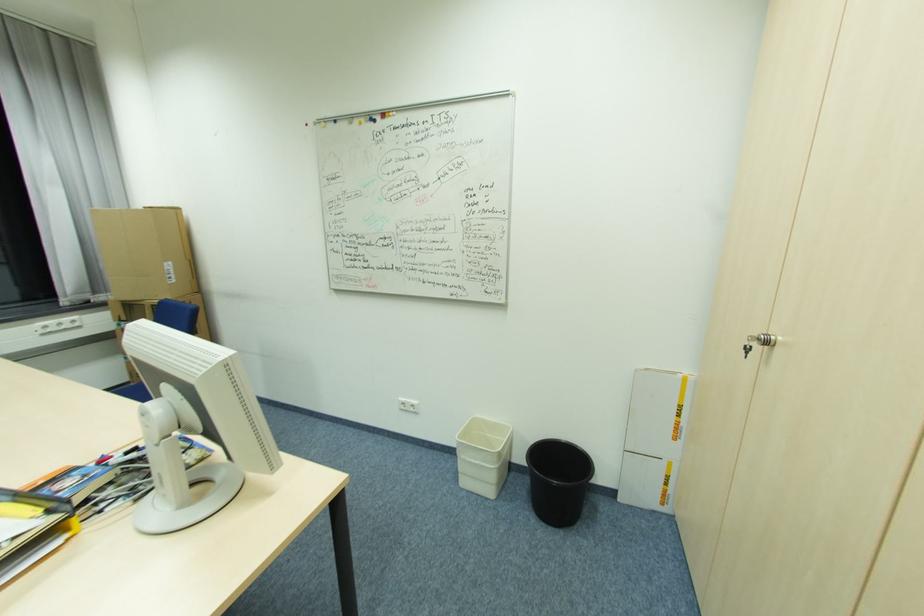
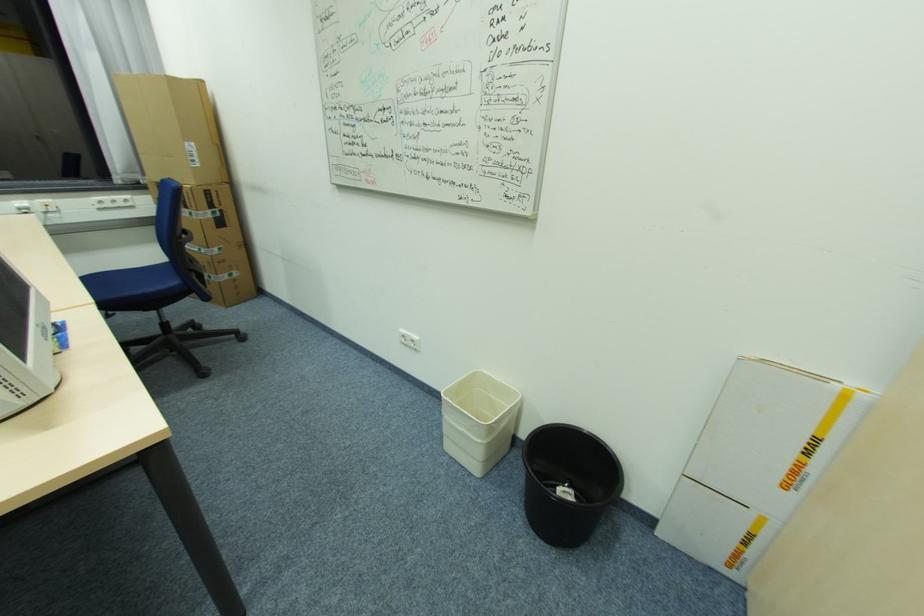
The point at (490,499) is marked in the first image. Where is the corresponding point in the second image?

(472, 475)